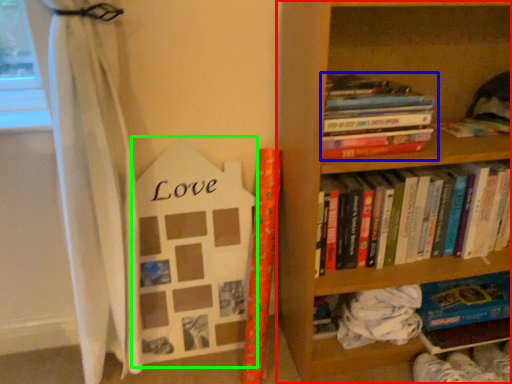
Question: Based on their relative distances, which object is farther from bookcase (highlighted by a red box)? Choose from book (highlighted by a blue box) and paperback book (highlighted by a green box).

Choices:
 (A) book
 (B) paperback book

Answer: (B)